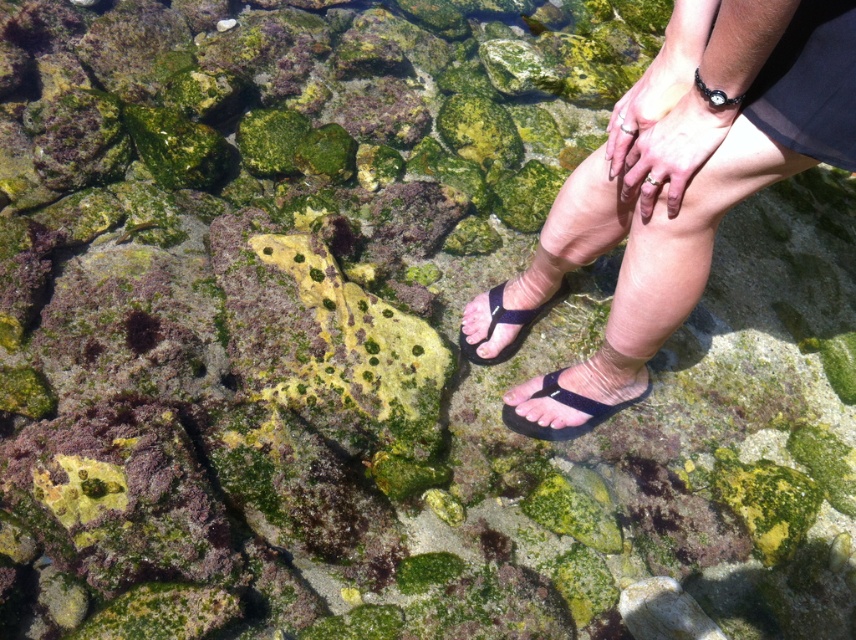
You are a lifeguard on duty and notice a person standing in the water. Based on the coordinates provided, can you identify the object located at point (676, 188)?

The point (676, 188) corresponds to the black rubber sandals at lower center.

You are a photographer trying to capture a detailed shot of the black rubber sandals at lower center and the black rubber sandal at lower right. Since you want to focus on both objects equally, which one should you adjust your camera angle to prioritize, considering their sizes?

The black rubber sandals at lower center is much taller than the black rubber sandal at lower right, so you should prioritize focusing on the black rubber sandals at lower center to ensure both are in clear view.